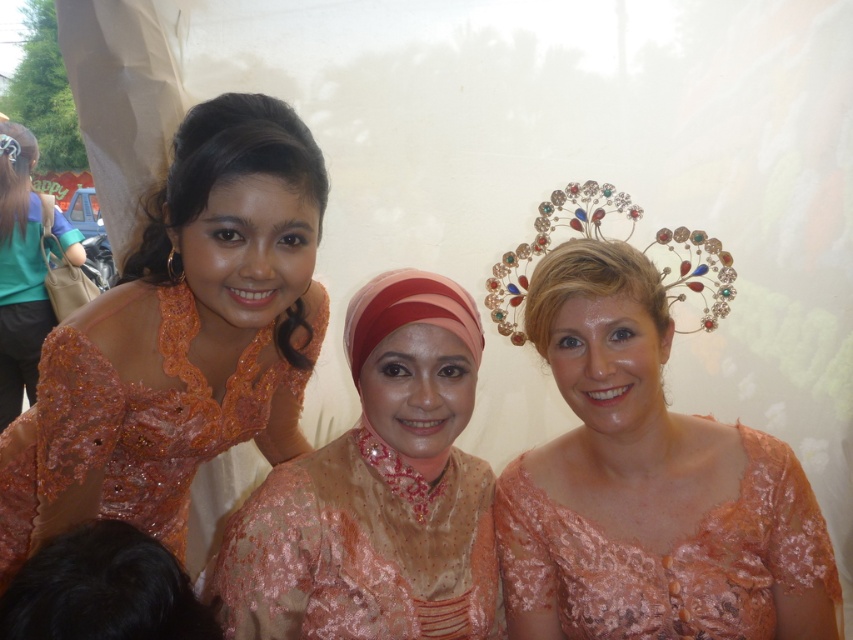
Can you confirm if pale pink satin hijab at center is taller than matte orange dress at left?

Incorrect, pale pink satin hijab at center's height is not larger of matte orange dress at left's.

Can you confirm if pale pink satin hijab at center is shorter than matte orange dress at left?

Yes, pale pink satin hijab at center is shorter than matte orange dress at left.

Identify the location of pale pink satin hijab at center. coord(368,512).

At what (x,y) coordinates should I click in order to perform the action: click on pale pink satin hijab at center. Please return your answer as a coordinate pair (x, y). The image size is (853, 640). Looking at the image, I should click on (368, 512).

Does matte peach lace dress at center have a lesser height compared to matte orange dress at left?

Yes.

Between matte peach lace dress at center and matte orange dress at left, which one appears on the right side from the viewer's perspective?

Positioned to the right is matte peach lace dress at center.

I want to click on matte peach lace dress at center, so click(646, 477).

I want to click on matte peach lace dress at center, so click(646, 477).

Is matte peach lace dress at center in front of lace dress at center?

Yes, matte peach lace dress at center is in front of lace dress at center.

Can you confirm if matte peach lace dress at center is positioned below lace dress at center?

No.

I want to click on matte peach lace dress at center, so click(646, 477).